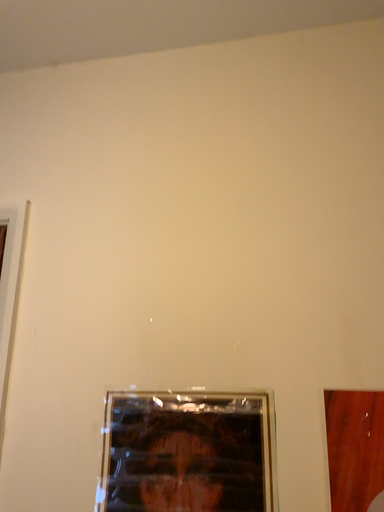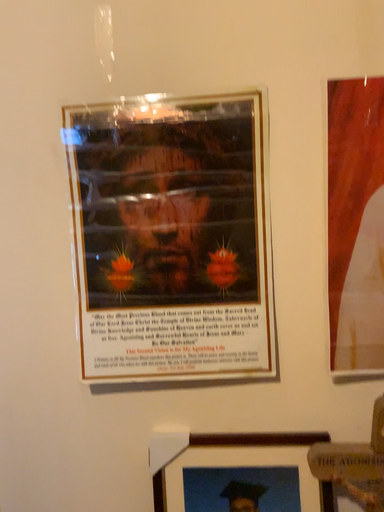
Question: How did the camera likely rotate when shooting the video?

Choices:
 (A) rotated downward
 (B) rotated upward

Answer: (A)